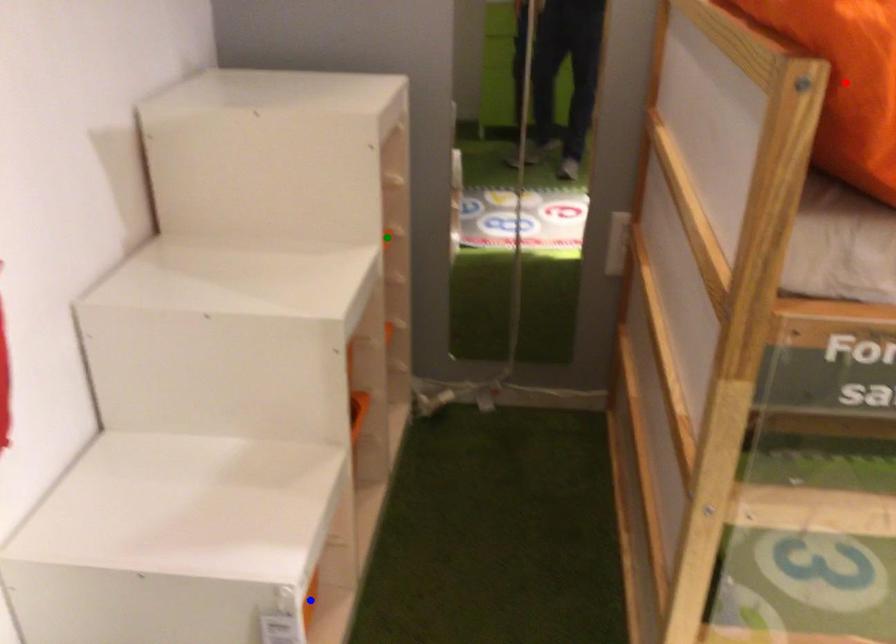
Order these from farthest to nearest:
- red point
- green point
- blue point

green point → blue point → red point